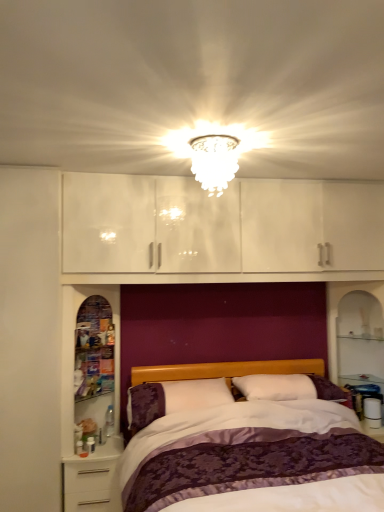
Question: Is white glossy nightstand at lower left not within white soft pillow at center?

Choices:
 (A) no
 (B) yes

Answer: (B)

Question: From the image's perspective, would you say white glossy nightstand at lower left is positioned over white soft pillow at center?

Choices:
 (A) no
 (B) yes

Answer: (A)

Question: From a real-world perspective, is white glossy nightstand at lower left below white soft pillow at center?

Choices:
 (A) yes
 (B) no

Answer: (A)

Question: Is white glossy nightstand at lower left shorter than white soft pillow at center?

Choices:
 (A) yes
 (B) no

Answer: (B)

Question: Is white glossy nightstand at lower left to the right of white soft pillow at center from the viewer's perspective?

Choices:
 (A) yes
 (B) no

Answer: (B)

Question: From the image's perspective, does white glossy nightstand at lower left appear lower than white soft pillow at center?

Choices:
 (A) yes
 (B) no

Answer: (A)

Question: Considering the relative sizes of white soft pillow at center and white glass chandelier at upper center in the image provided, is white soft pillow at center smaller than white glass chandelier at upper center?

Choices:
 (A) yes
 (B) no

Answer: (B)

Question: Is white soft pillow at center at the right side of white glass chandelier at upper center?

Choices:
 (A) no
 (B) yes

Answer: (A)

Question: Considering the relative sizes of white soft pillow at center and white glass chandelier at upper center in the image provided, is white soft pillow at center shorter than white glass chandelier at upper center?

Choices:
 (A) no
 (B) yes

Answer: (B)

Question: Is the depth of white soft pillow at center less than that of white glass chandelier at upper center?

Choices:
 (A) no
 (B) yes

Answer: (A)

Question: Is white soft pillow at center to the left of white glass chandelier at upper center from the viewer's perspective?

Choices:
 (A) no
 (B) yes

Answer: (B)

Question: Could you tell me if white soft pillow at center is turned towards white glass chandelier at upper center?

Choices:
 (A) yes
 (B) no

Answer: (B)

Question: Can you confirm if purple satin bed at center is bigger than white soft pillow at center?

Choices:
 (A) no
 (B) yes

Answer: (B)